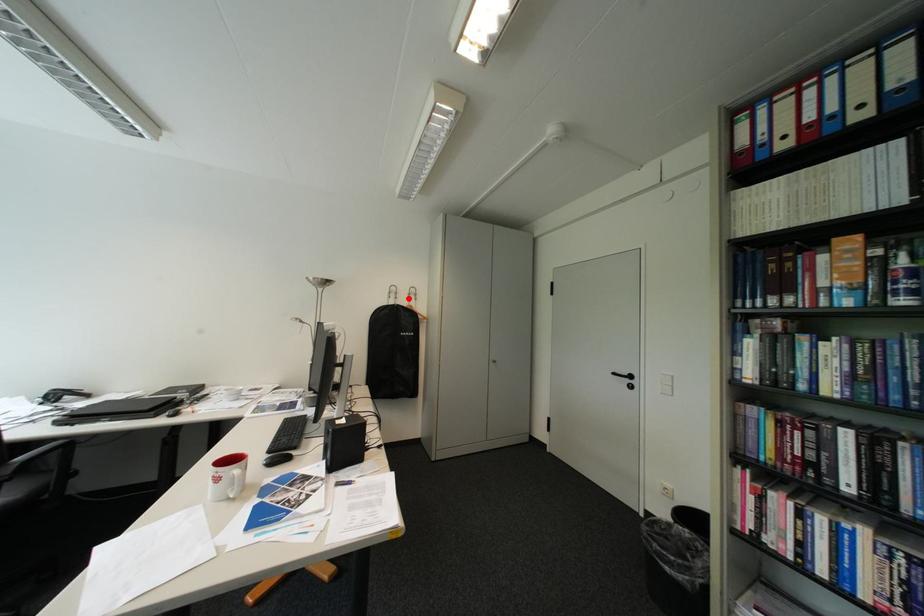
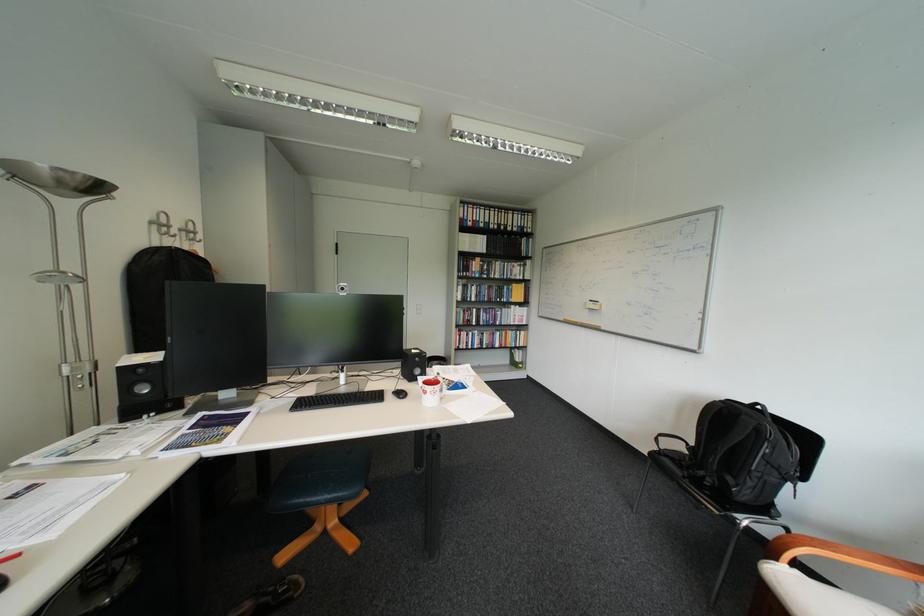
Where in the second image is the point corresponding to the highlighted location from the first image?

(187, 237)